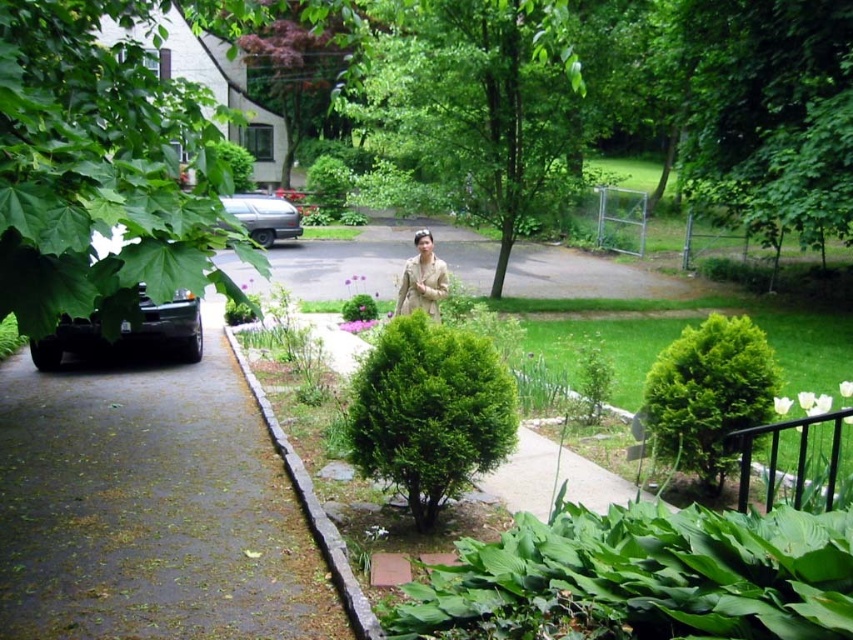
Question: Can you confirm if green leafy bush at center is wider than tan fabric jacket at center?

Choices:
 (A) yes
 (B) no

Answer: (A)

Question: Does gray asphalt pavement at lower left appear over green leafy tree at center?

Choices:
 (A) yes
 (B) no

Answer: (B)

Question: Estimate the real-world distances between objects in this image. Which object is closer to the gray stone curb at center?

Choices:
 (A) gray asphalt pavement at lower left
 (B) tan fabric jacket at center

Answer: (A)

Question: Which of these objects is positioned farthest from the green leafy tree at center?

Choices:
 (A) gray stone curb at center
 (B) green leafy tree at left

Answer: (A)

Question: Estimate the real-world distances between objects in this image. Which object is closer to the gray asphalt pavement at lower left?

Choices:
 (A) tan fabric jacket at center
 (B) green textured bush at right
 (C) green leafy tree at center
 (D) green leafy bush at center

Answer: (D)

Question: Can you confirm if green leafy tree at center is positioned below green leafy bush at center?

Choices:
 (A) no
 (B) yes

Answer: (A)